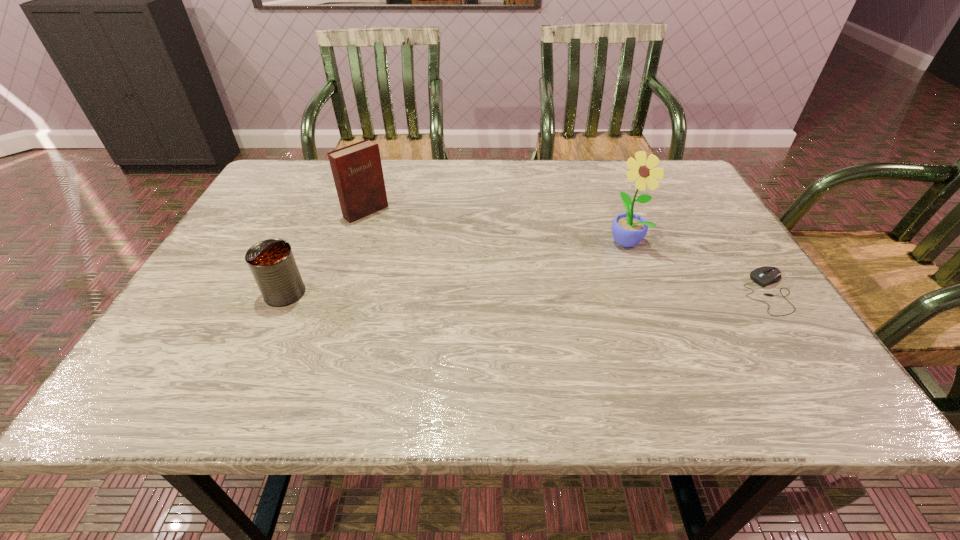
At what (x,y) coordinates should I click in order to perform the action: click on blank region between the rightmost object and the third nearest object. Please return your answer as a coordinate pair (x, y). This screenshot has height=540, width=960. Looking at the image, I should click on (696, 267).

Identify the location of free space between the second object from left to right and the sunflower. (495, 226).

Locate an element on the screen. This screenshot has width=960, height=540. vacant region between the rightmost object and the second object from left to right is located at coordinates (567, 252).

Locate an element on the screen. This screenshot has width=960, height=540. vacant space in between the farthest object and the can is located at coordinates (325, 252).

Identify the location of unoccupied area between the diary and the can. (325, 252).

Image resolution: width=960 pixels, height=540 pixels. Find the location of `vacant area between the second object from left to right and the rightmost object`. vacant area between the second object from left to right and the rightmost object is located at coordinates (567, 252).

Select which object is the third closest to the third shortest object. Please provide its 2D coordinates. Your answer should be formatted as a tuple, i.e. [(x, y)], where the tuple contains the x and y coordinates of a point satisfying the conditions above.

[(763, 276)]

Where is `object that is the second closest one to the rightmost object`? The image size is (960, 540). object that is the second closest one to the rightmost object is located at coordinates (357, 171).

Locate an element on the screen. The width and height of the screenshot is (960, 540). free spot that satisfies the following two spatial constraints: 1. on the front side of the tallest object; 2. on the right side of the shortest object is located at coordinates (645, 293).

I want to click on free space that satisfies the following two spatial constraints: 1. on the back side of the diary; 2. on the left side of the can, so click(x=322, y=212).